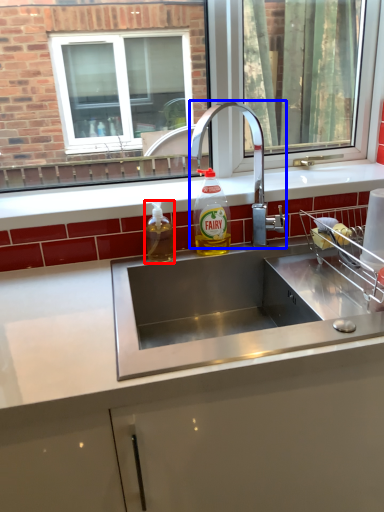
Question: Among these objects, which one is farthest to the camera, bottle (highlighted by a red box) or tap (highlighted by a blue box)?

Choices:
 (A) bottle
 (B) tap

Answer: (A)